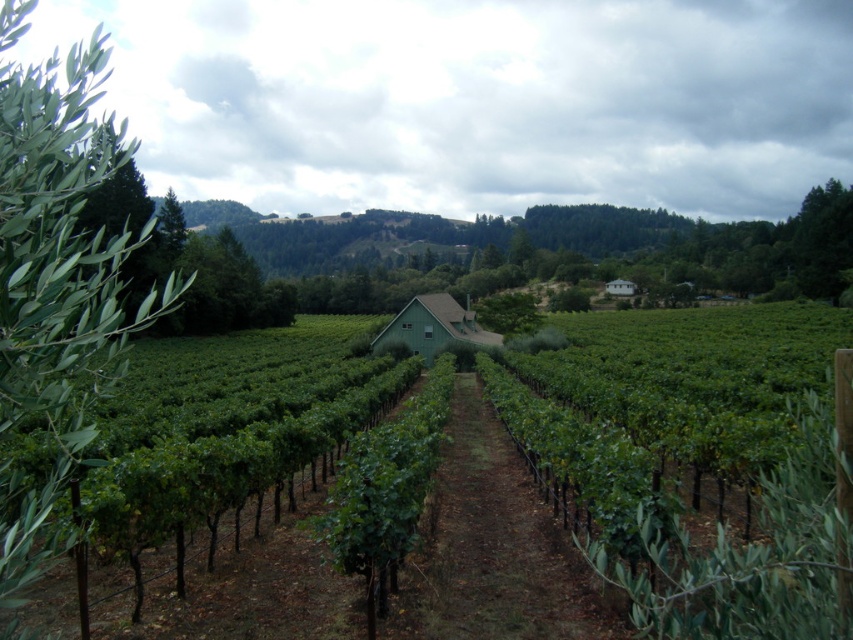
Based on the photo, does green matte vineyard at center have a lesser height compared to green leafy tree at left?

Correct, green matte vineyard at center is not as tall as green leafy tree at left.

Consider the image. Does green matte vineyard at center come behind green leafy tree at left?

That is True.

Identify the location of green matte vineyard at center. This screenshot has height=640, width=853. (218, 570).